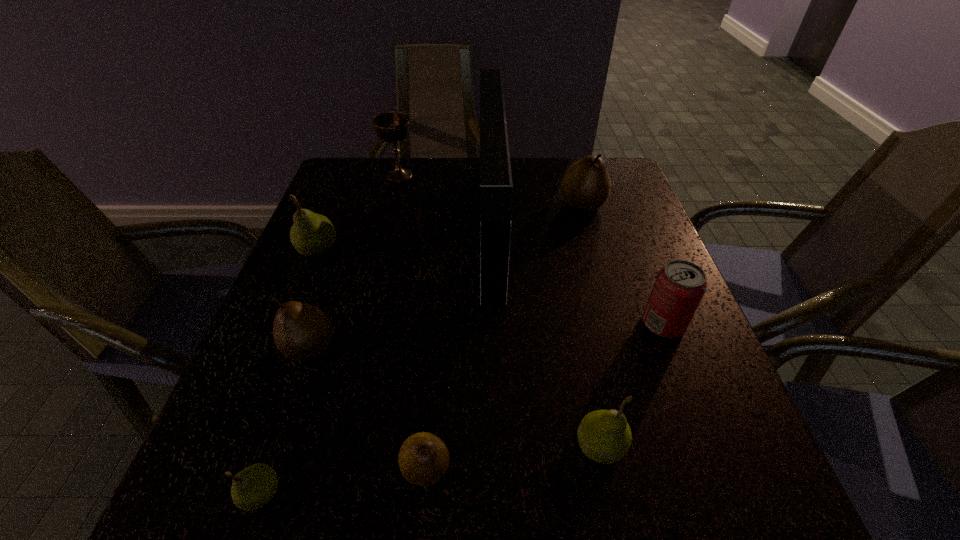
Identify the location of free space at the near left corner. This screenshot has height=540, width=960. (218, 527).

Locate an element on the screen. This screenshot has height=540, width=960. free point at the far right corner is located at coordinates (625, 171).

Where is `free space between the nearest green pear and the smallest brown pear`? free space between the nearest green pear and the smallest brown pear is located at coordinates (344, 480).

The width and height of the screenshot is (960, 540). Find the location of `vacant space that is in between the nearest brown pear and the chalice`. vacant space that is in between the nearest brown pear and the chalice is located at coordinates (413, 321).

Where is `empty space that is in between the chalice and the biggest green pear`? empty space that is in between the chalice and the biggest green pear is located at coordinates (358, 212).

This screenshot has width=960, height=540. I want to click on empty space between the nearest green pear and the soda can, so click(463, 408).

Find the location of a particular element. The height and width of the screenshot is (540, 960). free space between the smallest green pear and the third pear from right to left is located at coordinates (344, 480).

You are a GUI agent. You are given a task and a screenshot of the screen. Output one action in this format:
    pyautogui.click(x=<x>, y=<y>)
    Task: Click on the free spot between the second farthest brown pear and the soda can
    The height and width of the screenshot is (540, 960).
    Given the screenshot: What is the action you would take?
    pyautogui.click(x=487, y=335)

Locate an element on the screen. This screenshot has height=540, width=960. vacant space in between the second farthest green pear and the chalice is located at coordinates (500, 310).

In order to click on unoccupied position between the biggest green pear and the chalice in this screenshot , I will do `click(358, 212)`.